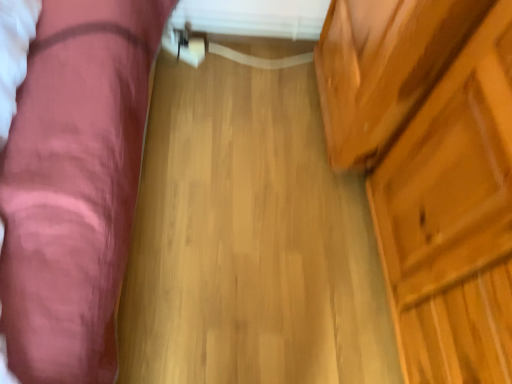
Where is `natural wood floor at center`? Image resolution: width=512 pixels, height=384 pixels. natural wood floor at center is located at coordinates (249, 240).

This screenshot has width=512, height=384. In order to click on wooden dresser at right in this screenshot , I will do `click(431, 170)`.

In order to click on natural wood floor at center in this screenshot , I will do (249, 240).

Is natural wood floor at center oriented away from wooden dresser at right?

Yes, wooden dresser at right is at the back of natural wood floor at center.

Can you tell me how much natural wood floor at center and wooden dresser at right differ in facing direction?

The angular difference between natural wood floor at center and wooden dresser at right is 1.29 degrees.

Considering the points (137, 319) and (419, 318), which point is behind, point (137, 319) or point (419, 318)?

The point (137, 319) is farther.

Does natural wood floor at center have a greater height compared to wooden dresser at right?

Incorrect, the height of natural wood floor at center is not larger of that of wooden dresser at right.

Can you tell me how much wooden dresser at right and natural wood floor at center differ in facing direction?

There is a 1.29-degree angle between the facing directions of wooden dresser at right and natural wood floor at center.

From the image's perspective, is wooden dresser at right above or below natural wood floor at center?

Based on their image positions, wooden dresser at right is located beneath natural wood floor at center.

Between wooden dresser at right and natural wood floor at center, which one appears on the left side from the viewer's perspective?

natural wood floor at center.

Is point (109, 345) positioned before point (196, 87)?

Yes, point (109, 345) is closer to viewer.

I want to click on plank to the right of velvet pink couch at left, so point(249,240).

From the image's perspective, is velvet pink couch at left located above or below natural wood floor at center?

Clearly, from the image's perspective, velvet pink couch at left is above natural wood floor at center.

Is velvet pink couch at left shorter than natural wood floor at center?

In fact, velvet pink couch at left may be taller than natural wood floor at center.

This screenshot has height=384, width=512. In order to click on dresser in front of the velvet pink couch at left in this screenshot , I will do `click(431, 170)`.

Which is in front, point (396, 315) or point (59, 261)?

The point (59, 261) is in front.

Does wooden dresser at right have a larger size compared to velvet pink couch at left?

No, wooden dresser at right is not bigger than velvet pink couch at left.

Is natural wood floor at center next to velvet pink couch at left and touching it?

No, natural wood floor at center is not making contact with velvet pink couch at left.

Where is `furniture located on the left of natural wood floor at center`? The height and width of the screenshot is (384, 512). furniture located on the left of natural wood floor at center is located at coordinates (74, 186).

From a real-world perspective, is natural wood floor at center positioned over velvet pink couch at left based on gravity?

Actually, natural wood floor at center is physically below velvet pink couch at left in the real world.

Considering the positions of objects velvet pink couch at left and wooden dresser at right in the image provided, who is in front, velvet pink couch at left or wooden dresser at right?

wooden dresser at right.

Between velvet pink couch at left and wooden dresser at right, which one has more height?

wooden dresser at right.

Can you tell me how much velvet pink couch at left and wooden dresser at right differ in facing direction?

The angular difference between velvet pink couch at left and wooden dresser at right is 88.3 degrees.

Based on the photo, is velvet pink couch at left located outside wooden dresser at right?

That's correct, velvet pink couch at left is outside of wooden dresser at right.

Find the location of a particular element. The height and width of the screenshot is (384, 512). plank lying behind the wooden dresser at right is located at coordinates (249, 240).

In order to click on plank that appears below the wooden dresser at right (from a real-world perspective) in this screenshot , I will do `click(249, 240)`.

Based on their spatial positions, is natural wood floor at center or wooden dresser at right closer to velvet pink couch at left?

natural wood floor at center is positioned closer to the anchor velvet pink couch at left.

Which object lies further to the anchor point natural wood floor at center, wooden dresser at right or velvet pink couch at left?

Answer: velvet pink couch at left lies further to natural wood floor at center than the other object.

Estimate the real-world distances between objects in this image. Which object is closer to wooden dresser at right, velvet pink couch at left or natural wood floor at center?

natural wood floor at center.

Looking at the image, which one is located closer to wooden dresser at right, natural wood floor at center or velvet pink couch at left?

Based on the image, natural wood floor at center appears to be nearer to wooden dresser at right.

From the picture: Looking at the image, which one is located closer to velvet pink couch at left, wooden dresser at right or natural wood floor at center?

Based on the image, natural wood floor at center appears to be nearer to velvet pink couch at left.

Considering their positions, is velvet pink couch at left positioned further to natural wood floor at center than wooden dresser at right?

velvet pink couch at left lies further to natural wood floor at center than the other object.

This screenshot has height=384, width=512. I want to click on plank located between velvet pink couch at left and wooden dresser at right in the left-right direction, so click(249, 240).